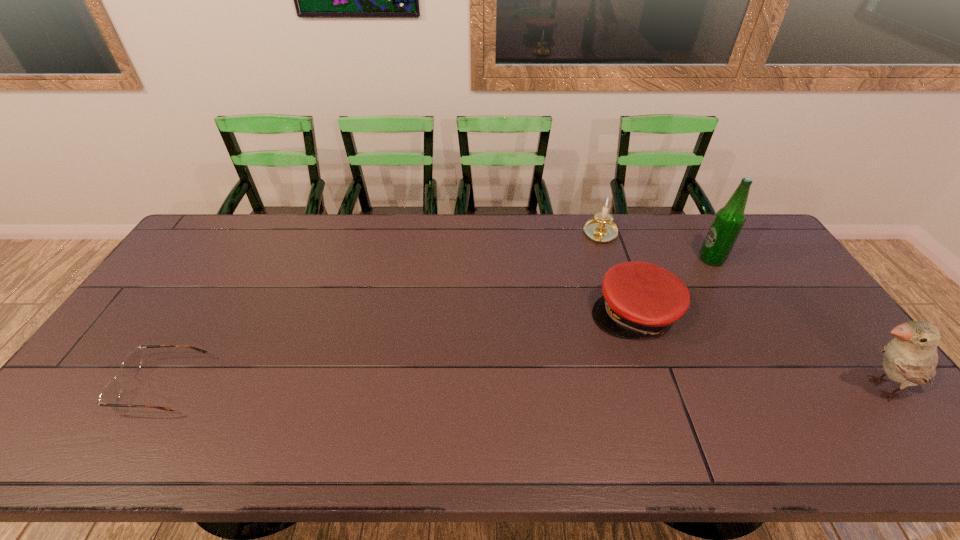
Locate an element on the screen. The width and height of the screenshot is (960, 540). free region located 0.050m on the front-facing side of the leftmost object is located at coordinates (106, 386).

What are the coordinates of `vacant area located 0.050m on the front-facing side of the leftmost object` in the screenshot? It's located at click(106, 386).

Where is `free region located at the face of the rightmost object`? This screenshot has width=960, height=540. free region located at the face of the rightmost object is located at coordinates (743, 388).

At what (x,y) coordinates should I click in order to perform the action: click on free space located at the face of the rightmost object. Please return your answer as a coordinate pair (x, y). Looking at the image, I should click on (723, 388).

In order to click on vacant region located at the face of the rightmost object in this screenshot , I will do `click(775, 388)`.

Where is `vacant space situated on the front-facing side of the cap`? The height and width of the screenshot is (540, 960). vacant space situated on the front-facing side of the cap is located at coordinates (612, 382).

You are a GUI agent. You are given a task and a screenshot of the screen. Output one action in this format:
    pyautogui.click(x=<x>, y=<y>)
    Task: Click on the free location located on the front-facing side of the cap
    The height and width of the screenshot is (540, 960).
    Given the screenshot: What is the action you would take?
    pyautogui.click(x=614, y=373)

The width and height of the screenshot is (960, 540). Find the location of `free space located on the front-facing side of the cap`. free space located on the front-facing side of the cap is located at coordinates (613, 379).

At what (x,y) coordinates should I click in order to perform the action: click on vacant region located on the handle side of the candle holder. Please return your answer as a coordinate pair (x, y). This screenshot has width=960, height=540. Looking at the image, I should click on (598, 309).

Locate an element on the screen. This screenshot has width=960, height=540. vacant space located on the handle side of the candle holder is located at coordinates (600, 276).